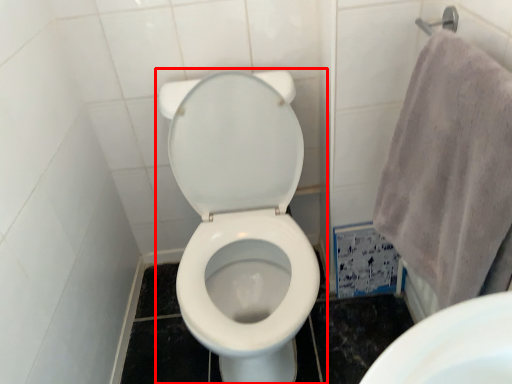
Question: From the image's perspective, where is toilet (annotated by the red box) located in relation to bath towel in the image?

Choices:
 (A) below
 (B) above

Answer: (A)